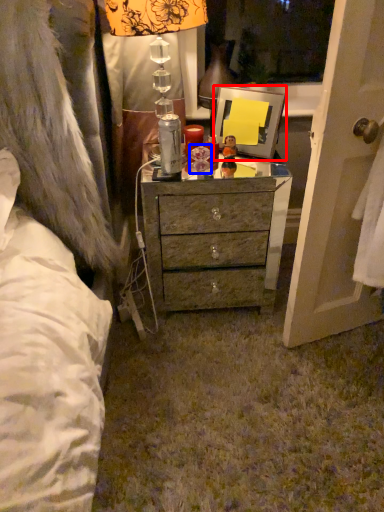
Question: Which object appears farthest to the camera in this image, picture frame (highlighted by a red box) or toy (highlighted by a blue box)?

Choices:
 (A) picture frame
 (B) toy

Answer: (B)